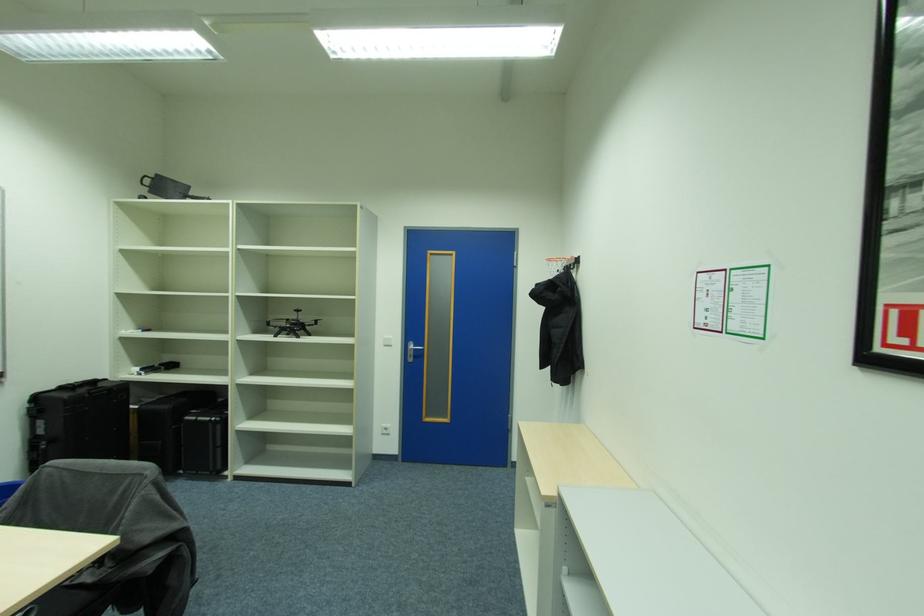
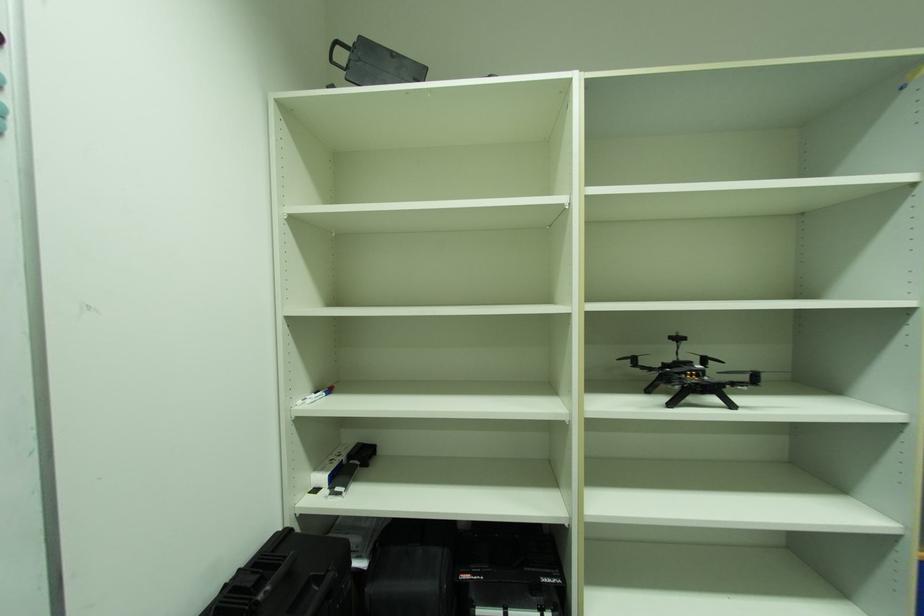
Which direction would the cameraman need to move to produce the second image?

The cameraman walked toward left, forward.